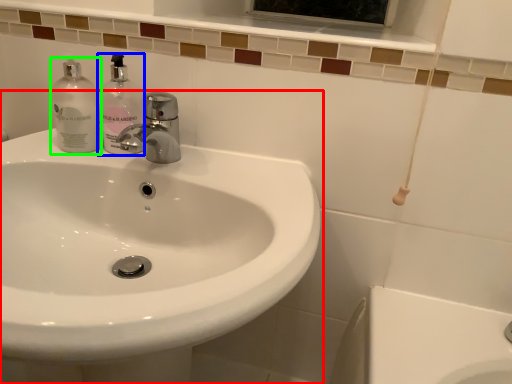
Question: Considering the real-world distances, which object is farthest from sink (highlighted by a red box)? soap dispenser (highlighted by a blue box) or cleaning product (highlighted by a green box)?

Choices:
 (A) soap dispenser
 (B) cleaning product

Answer: (B)